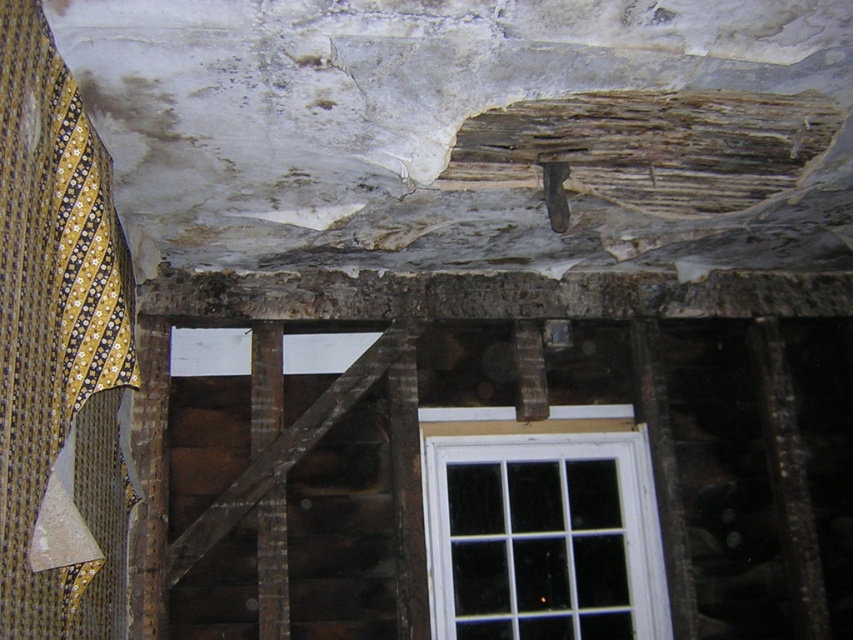
You are standing in the center of the room and notice the yellow striped fabric at left. Based on its position, can you determine if it is closer to the ceiling or the floor?

The yellow striped fabric at left is located at point coordinates that place it closer to the ceiling than the floor. The coordinates are given as x,y values where the top left corner is (0, 0) and bottom right is (852, 639). Since the y coordinate is 0.069, it is near the top of the image, which corresponds to the ceiling area in the scene.

You are standing in the room depicted in the image. There is a point at coordinates (x=57, y=349). What object does this point correspond to?

The point at coordinates (x=57, y=349) corresponds to the yellow striped fabric at left.